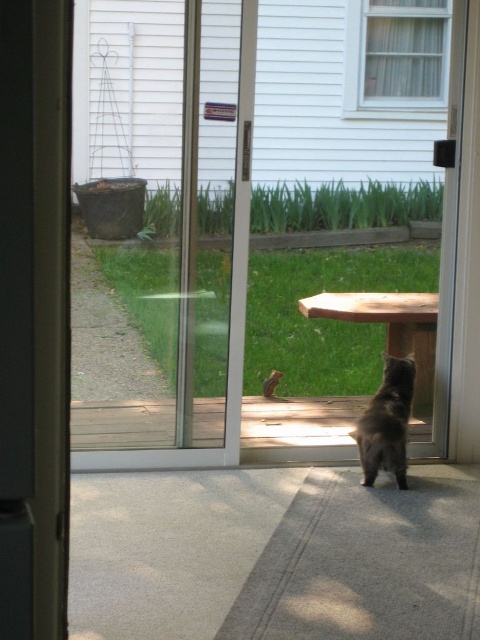
Which is in front, point (72, 451) or point (377, 429)?

Point (377, 429)

What are the coordinates of `transparent glass screen door at center` in the screenshot? It's located at coord(229,300).

Where is `transparent glass screen door at center`? The height and width of the screenshot is (640, 480). transparent glass screen door at center is located at coordinates (229, 300).